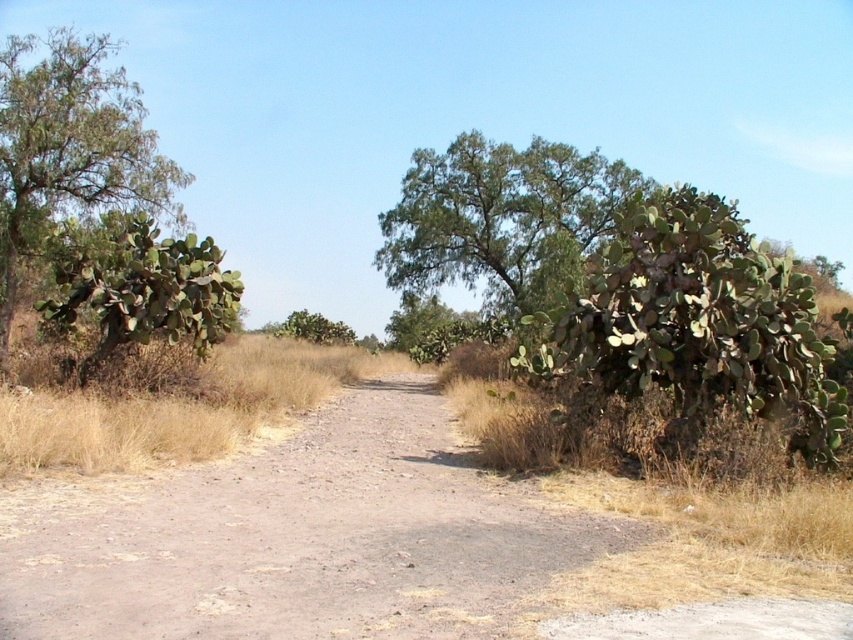
Is green leafy tree at left below green spiny cactus at left?

No.

Who is more forward, (x=73, y=99) or (x=115, y=260)?

Positioned in front is point (x=115, y=260).

Where is `green leafy tree at left`? green leafy tree at left is located at coordinates (68, 147).

Who is positioned more to the right, dirt road at center or green spiny cactus at left?

dirt road at center is more to the right.

You are a GUI agent. You are given a task and a screenshot of the screen. Output one action in this format:
    pyautogui.click(x=<x>, y=<y>)
    Task: Click on the dirt road at center
    The width and height of the screenshot is (853, 640).
    Given the screenshot: What is the action you would take?
    pyautogui.click(x=294, y=538)

Who is more forward, (79, 516) or (10, 288)?

Positioned in front is point (79, 516).

Identify the location of dirt road at center. (294, 538).

I want to click on dirt road at center, so click(294, 538).